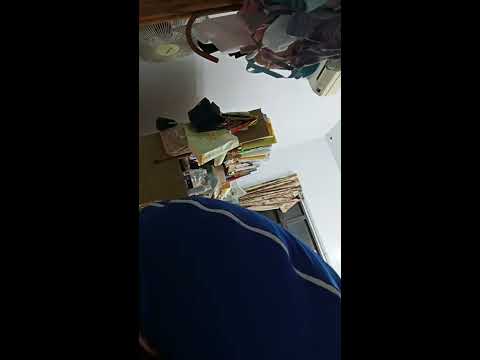
At what (x,y) coordinates should I click in order to perform the action: click on fan. Please return your answer as a coordinate pair (x, y). The image size is (480, 360). Looking at the image, I should click on (160, 47).